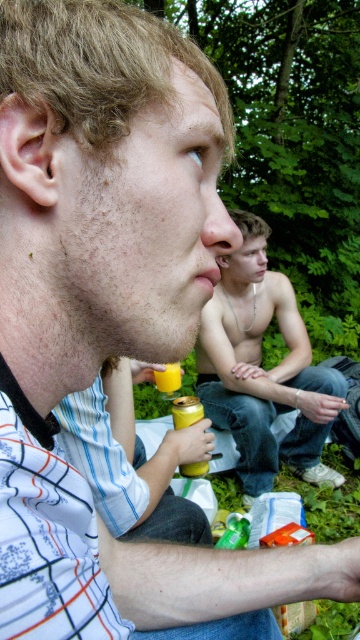
Question: Does shiny metallic can at center appear on the left side of yellow matte cup at lower center?

Choices:
 (A) no
 (B) yes

Answer: (A)

Question: Can you confirm if shiny metallic can at center is smaller than yellow matte can at lower center?

Choices:
 (A) no
 (B) yes

Answer: (A)

Question: Which of the following is the farthest from the observer?

Choices:
 (A) (164, 385)
 (B) (200, 464)
 (C) (226, 376)

Answer: (C)

Question: Which object is closer to the camera taking this photo?

Choices:
 (A) yellow matte cup at lower center
 (B) yellow matte can at lower center
 (C) shiny metallic can at center

Answer: (B)

Question: Which object appears farthest from the camera in this image?

Choices:
 (A) yellow matte cup at lower center
 (B) shiny metallic can at center
 (C) yellow matte can at lower center

Answer: (B)

Question: Can you confirm if shiny metallic can at center is wider than yellow matte can at lower center?

Choices:
 (A) yes
 (B) no

Answer: (A)